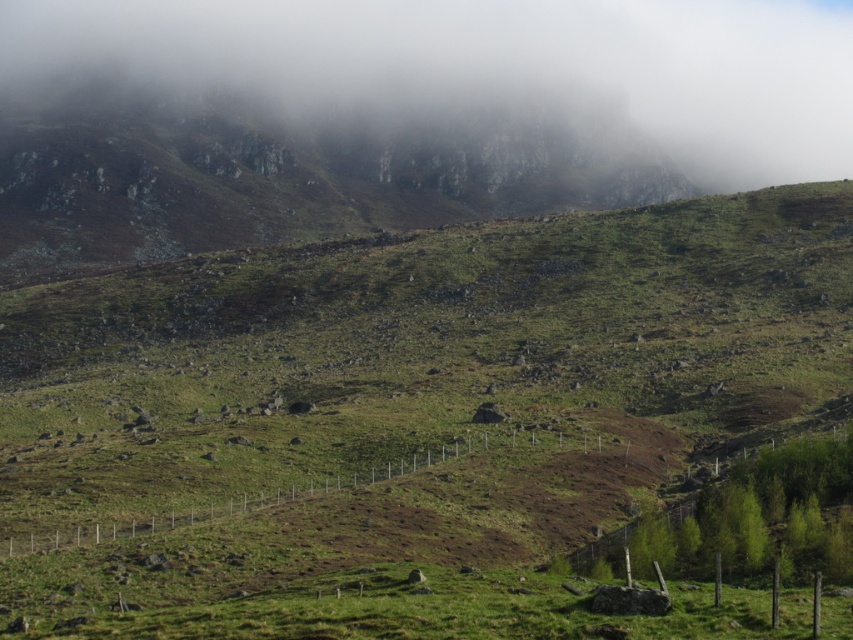
Question: Which object is positioned farthest from the foggy rock formation at upper center?

Choices:
 (A) green grassy field at lower center
 (B) rocky gray mountain at upper left

Answer: (A)

Question: Can you confirm if foggy rock formation at upper center is bigger than green grassy field at lower center?

Choices:
 (A) no
 (B) yes

Answer: (B)

Question: Which of the following is the closest to the observer?

Choices:
 (A) (393, 45)
 (B) (64, 595)

Answer: (B)

Question: Which is farther from the green grassy field at lower center?

Choices:
 (A) foggy rock formation at upper center
 (B) rocky gray mountain at upper left

Answer: (A)

Question: Does foggy rock formation at upper center have a greater width compared to green grassy field at lower center?

Choices:
 (A) yes
 (B) no

Answer: (A)

Question: Is foggy rock formation at upper center smaller than rocky gray mountain at upper left?

Choices:
 (A) yes
 (B) no

Answer: (B)